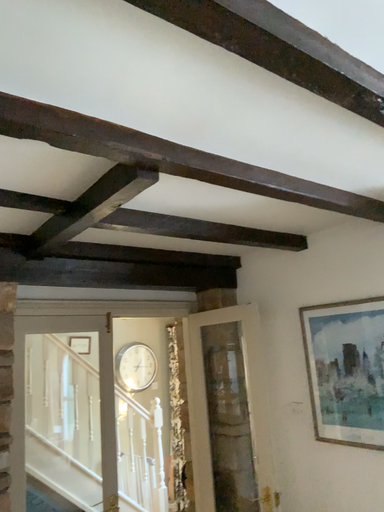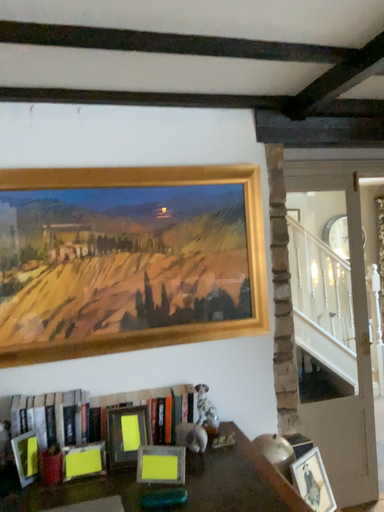
Question: Which way did the camera rotate in the video?

Choices:
 (A) rotated right
 (B) rotated left

Answer: (B)